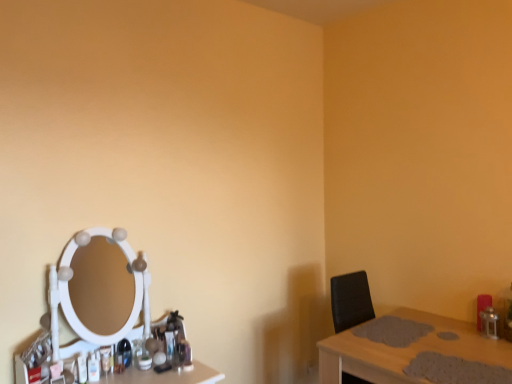
Question: From a real-world perspective, is wooden table at right physically above white glossy makeup mirror at left?

Choices:
 (A) no
 (B) yes

Answer: (A)

Question: Would you consider wooden table at right to be distant from white glossy makeup mirror at left?

Choices:
 (A) yes
 (B) no

Answer: (A)

Question: Can you confirm if wooden table at right is bigger than white glossy makeup mirror at left?

Choices:
 (A) yes
 (B) no

Answer: (A)

Question: Is the position of wooden table at right less distant than that of white glossy makeup mirror at left?

Choices:
 (A) no
 (B) yes

Answer: (B)

Question: Could you tell me if wooden table at right is facing white glossy makeup mirror at left?

Choices:
 (A) yes
 (B) no

Answer: (B)

Question: Is wooden table at right taller than white glossy makeup mirror at left?

Choices:
 (A) no
 (B) yes

Answer: (A)

Question: Does white glossy makeup mirror at left come behind wooden table at right?

Choices:
 (A) yes
 (B) no

Answer: (A)

Question: Is white glossy makeup mirror at left in front of wooden table at right?

Choices:
 (A) yes
 (B) no

Answer: (B)

Question: Can you confirm if white glossy makeup mirror at left is positioned to the right of wooden table at right?

Choices:
 (A) no
 (B) yes

Answer: (A)

Question: Is wooden table at right at the back of white glossy makeup mirror at left?

Choices:
 (A) yes
 (B) no

Answer: (B)

Question: Are white glossy makeup mirror at left and wooden table at right far apart?

Choices:
 (A) yes
 (B) no

Answer: (A)

Question: From the image's perspective, is white glossy makeup mirror at left above wooden table at right?

Choices:
 (A) no
 (B) yes

Answer: (B)

Question: Considering the relative positions of wooden table at right and white glossy makeup mirror at left in the image provided, is wooden table at right to the left or to the right of white glossy makeup mirror at left?

Choices:
 (A) left
 (B) right

Answer: (B)